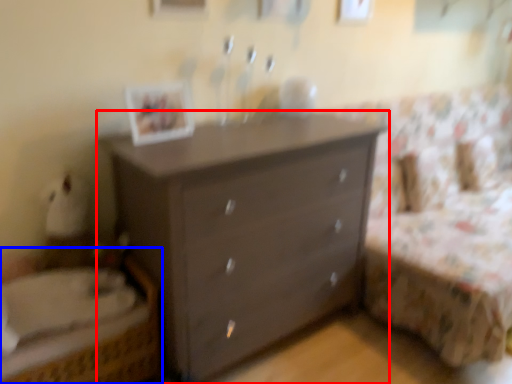
Question: Which point is closer to the camera, chest of drawers (highlighted by a red box) or bed (highlighted by a blue box)?

Choices:
 (A) chest of drawers
 (B) bed

Answer: (B)